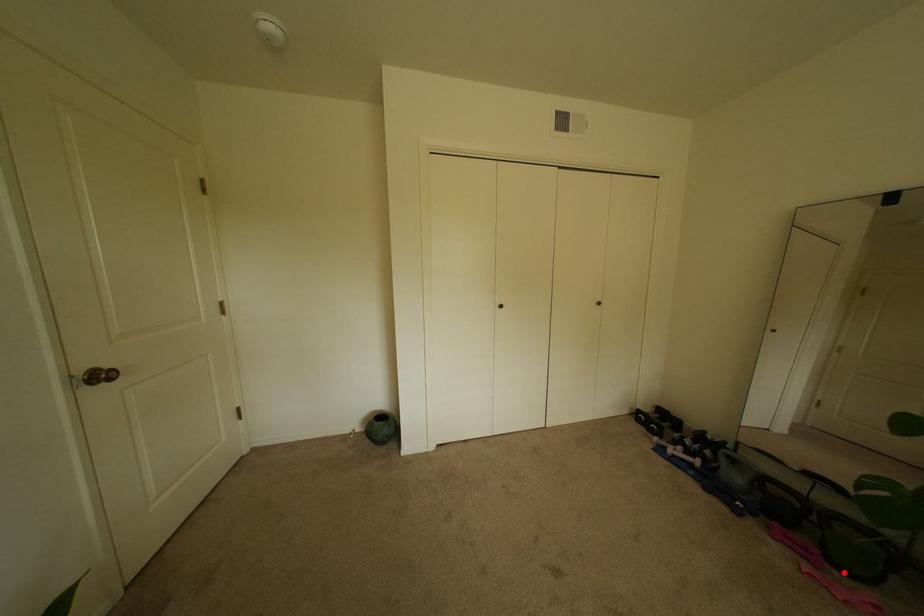
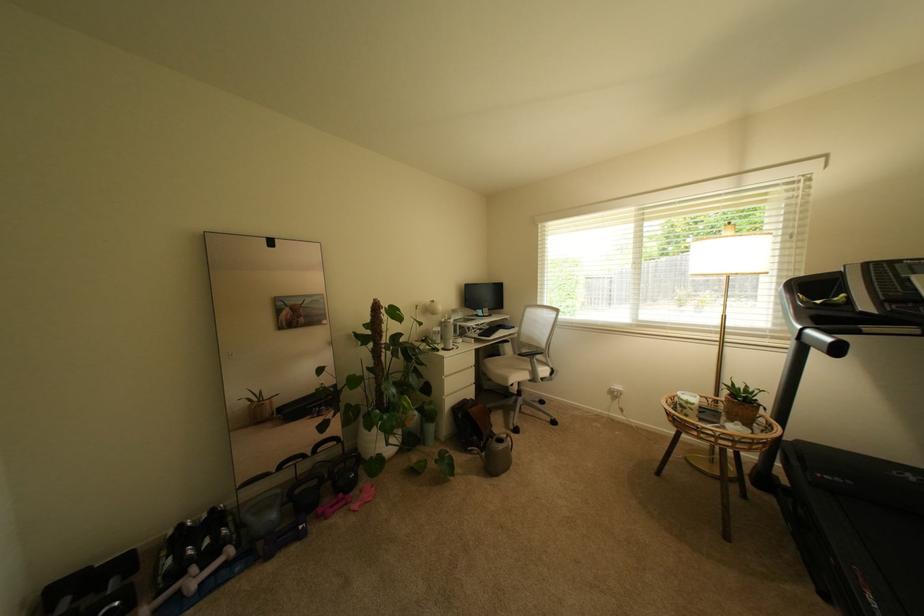
The point at the highlighted location is marked in the first image. Where is the corresponding point in the second image?

(359, 495)